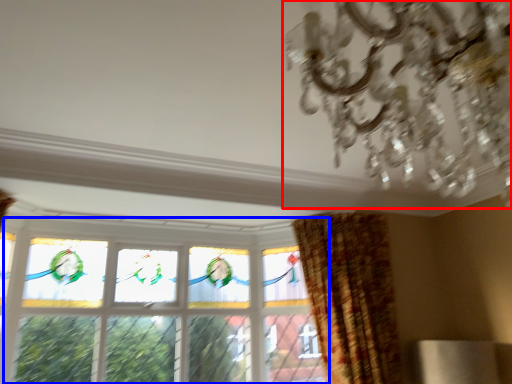
Question: Among these objects, which one is farthest to the camera, chandelier (highlighted by a red box) or window (highlighted by a blue box)?

Choices:
 (A) chandelier
 (B) window

Answer: (B)